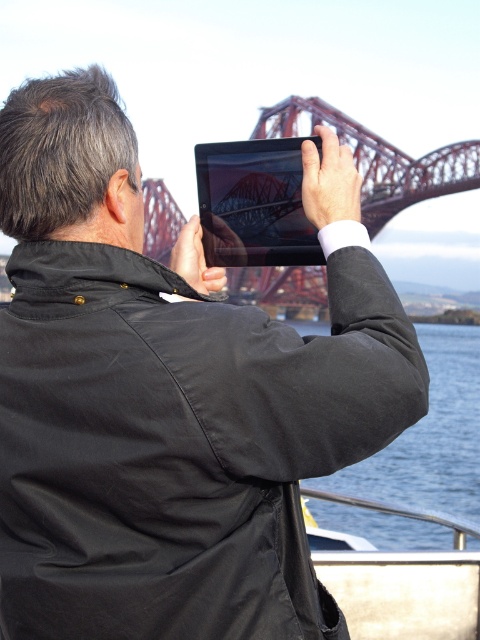
Is point (382, 563) behind point (320, 147)?

That is True.

Is point (436, 612) behind point (260, 244)?

Yes.

Image resolution: width=480 pixels, height=640 pixels. In order to click on metallic silver boat at lower right in this screenshot , I will do `click(405, 593)`.

Is blue water at lower right further to the viewer compared to matte black tablet at upper center?

No, it is not.

Is blue water at lower right above matte black tablet at upper center?

Actually, blue water at lower right is below matte black tablet at upper center.

Describe the element at coordinates (430, 436) in the screenshot. I see `blue water at lower right` at that location.

Locate an element on the screen. blue water at lower right is located at coordinates (430, 436).

Is blue water at lower right thinner than metallic silver boat at lower right?

In fact, blue water at lower right might be wider than metallic silver boat at lower right.

Between blue water at lower right and metallic silver boat at lower right, which one has more height?

blue water at lower right is taller.

This screenshot has height=640, width=480. Find the location of `blue water at lower right`. blue water at lower right is located at coordinates (x=430, y=436).

This screenshot has height=640, width=480. In order to click on blue water at lower right in this screenshot , I will do `click(430, 436)`.